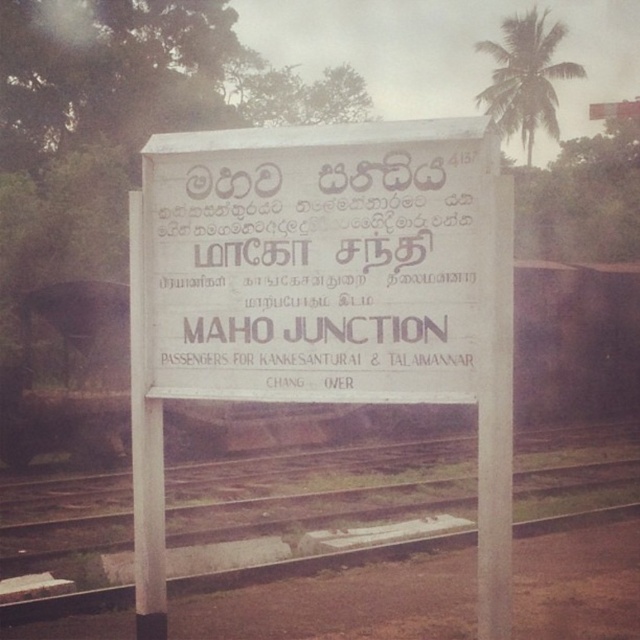
Question: Which object is positioned closest to the white matte sign at center?

Choices:
 (A) white paper sign at center
 (B) brown wooden train track at center

Answer: (A)

Question: Can you confirm if white matte sign at center is positioned below white paper sign at center?

Choices:
 (A) no
 (B) yes

Answer: (B)

Question: Among these points, which one is farthest from the camera?

Choices:
 (A) (323, 243)
 (B) (435, 160)
 (C) (518, 493)

Answer: (C)

Question: Can you confirm if white paper sign at center is wider than brown wooden train track at center?

Choices:
 (A) no
 (B) yes

Answer: (A)

Question: Which point is farther from the camera taking this photo?

Choices:
 (A) click(182, 152)
 (B) click(371, 497)

Answer: (B)

Question: Can you confirm if white paper sign at center is smaller than brown wooden train track at center?

Choices:
 (A) no
 (B) yes

Answer: (B)